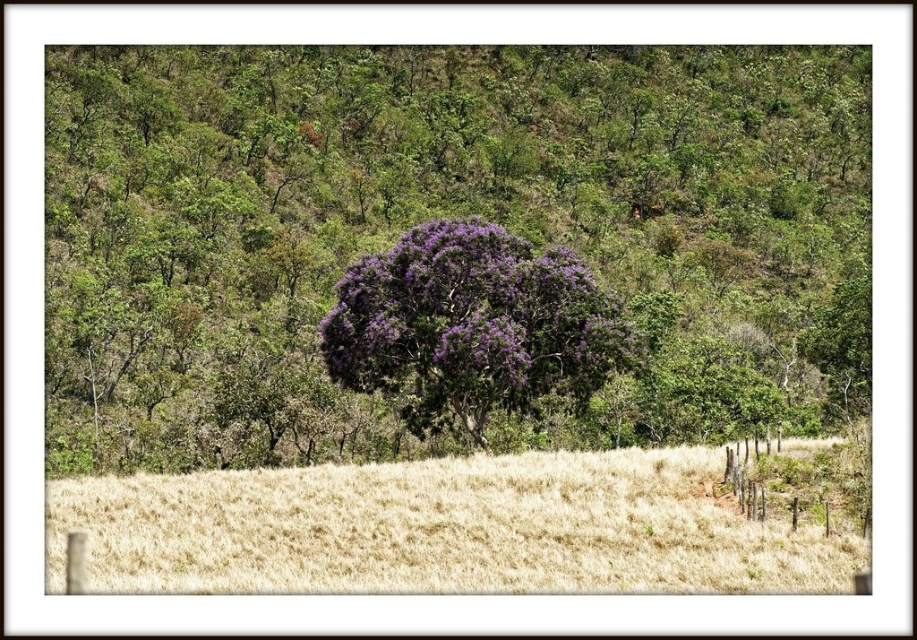
You are standing at the edge of the dry straw field at lower center and want to see the top of the purple leafy bush at center. Can you see it clearly from your current position?

The dry straw field at lower center is shorter than the purple leafy bush at center, so yes, you can see the top of the purple leafy bush at center clearly from your current position.

You are standing in the field of dry grass and looking at the purple leafy tree at center and the purple leafy bush at center. Which one is closer to you?

The purple leafy tree at center is closer to you because the purple leafy bush at center is behind it.